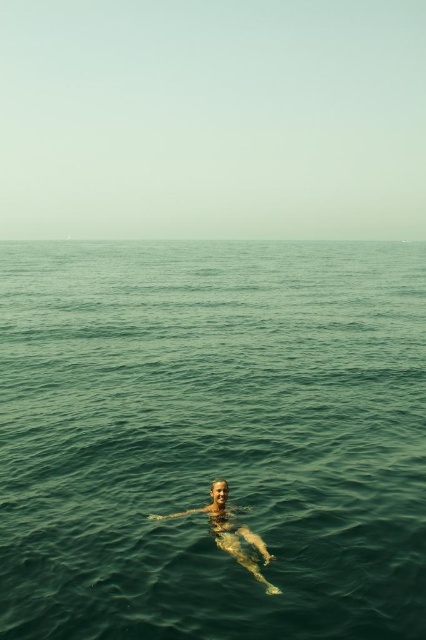
You are a swimmer floating in the middle of the ocean. You notice a point marked at coordinates (212, 436). Based on the scene, what does this point represent?

The point at coordinates (212, 436) represents the green water at center.

You are a photographer positioned on a boat and want to capture a clear shot of the smooth skin person at center without the green water at center obstructing the view. Is this possible given their positions?

The green water at center is closer to the viewer than the smooth skin person at center, so the water would block the direct line of sight to the person. Adjust your position or angle to avoid the obstruction.

You are a lifeguard observing the scene. You notice the green water at center and the smooth skin person at center. Which object is taller in the image?

The green water at center is taller than the smooth skin person at center.